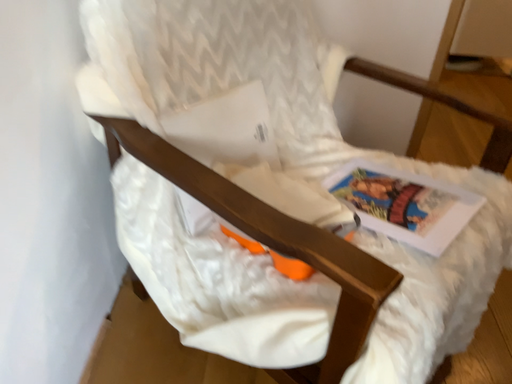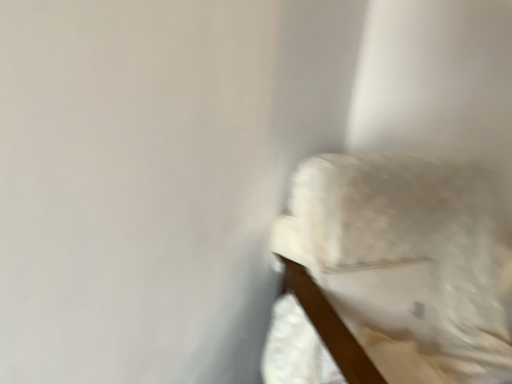
Question: Which way did the camera rotate in the video?

Choices:
 (A) rotated left
 (B) rotated right

Answer: (A)